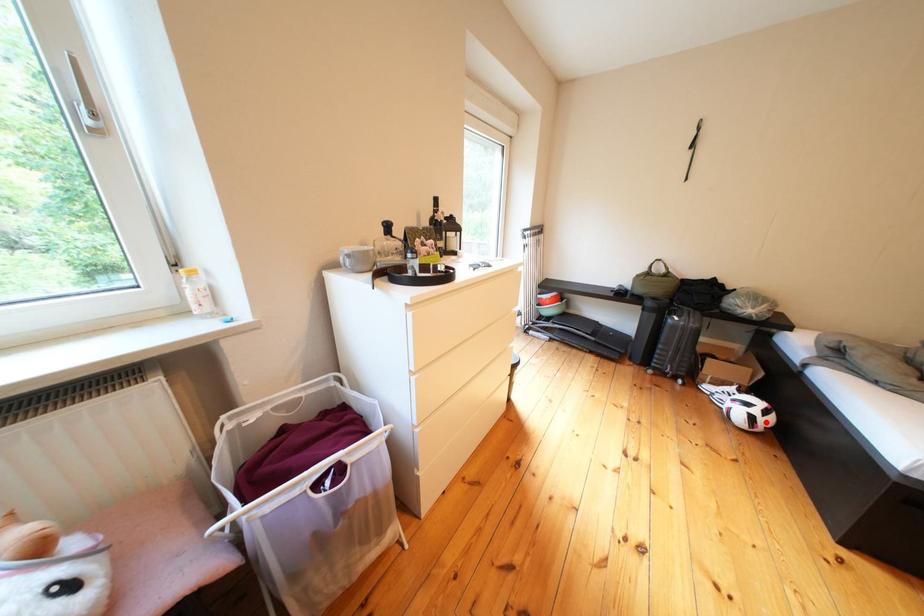
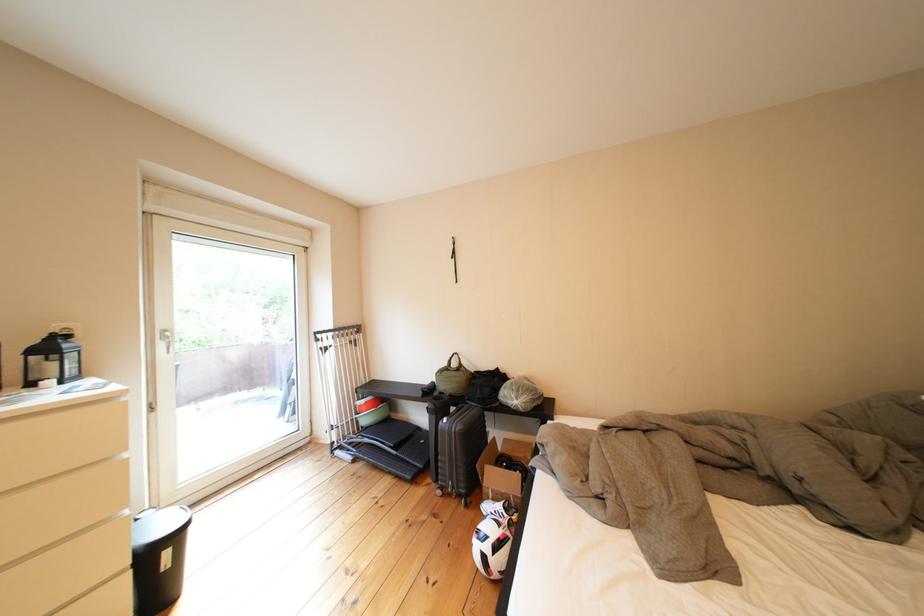
In the second image, find the point that corresponds to the highlighted location in the first image.

(499, 562)